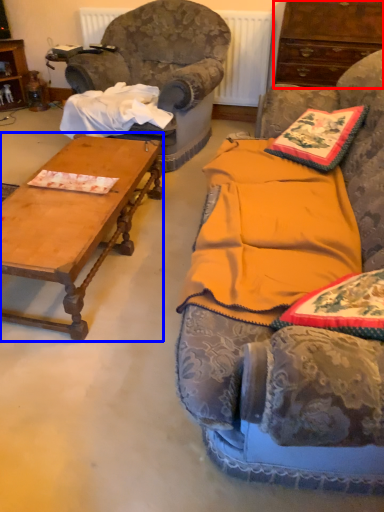
Question: Among these objects, which one is nearest to the camera, cabinetry (highlighted by a red box) or coffee table (highlighted by a blue box)?

Choices:
 (A) cabinetry
 (B) coffee table

Answer: (B)